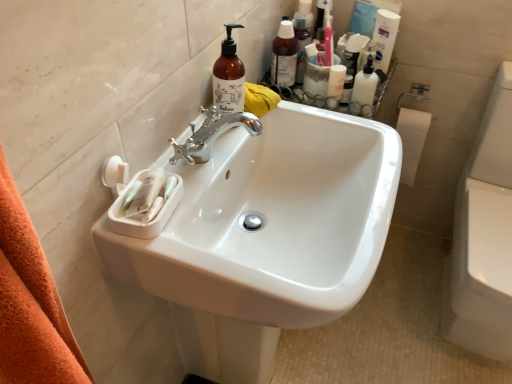
Question: Is white glossy lotion at upper right, acting as the first toiletry starting from the right, facing away from white matte jar at upper right, the second toiletry viewed from the left?

Choices:
 (A) no
 (B) yes

Answer: (A)

Question: Is white glossy lotion at upper right, marked as the 3th toiletry in a left-to-right arrangement, shorter than white matte jar at upper right, the 2th toiletry when ordered from right to left?

Choices:
 (A) yes
 (B) no

Answer: (B)

Question: From a real-world perspective, is white glossy lotion at upper right, marked as the 3th toiletry in a left-to-right arrangement, over white matte jar at upper right, the second toiletry viewed from the left?

Choices:
 (A) yes
 (B) no

Answer: (A)

Question: Does white glossy lotion at upper right, acting as the first toiletry starting from the right, have a smaller size compared to white matte jar at upper right, the second toiletry viewed from the left?

Choices:
 (A) yes
 (B) no

Answer: (B)

Question: Is there a large distance between white glossy lotion at upper right, marked as the 3th toiletry in a left-to-right arrangement, and white matte jar at upper right, the second toiletry viewed from the left?

Choices:
 (A) no
 (B) yes

Answer: (A)

Question: Is white glossy lotion at upper right, acting as the first toiletry starting from the right, wider or thinner than translucent amber bottle at upper center, which appears as the second cleaning product when viewed from the top?

Choices:
 (A) thin
 (B) wide

Answer: (A)

Question: From a real-world perspective, is white glossy lotion at upper right, acting as the first toiletry starting from the right, physically located above or below translucent amber bottle at upper center, which ranks as the 1th cleaning product in bottom-to-top order?

Choices:
 (A) below
 (B) above

Answer: (A)

Question: Considering their positions, is white glossy lotion at upper right, acting as the first toiletry starting from the right, located in front of or behind translucent amber bottle at upper center, which ranks as the 1th cleaning product in bottom-to-top order?

Choices:
 (A) behind
 (B) front

Answer: (A)

Question: Does point (361, 71) appear closer or farther from the camera than point (238, 81)?

Choices:
 (A) farther
 (B) closer

Answer: (A)

Question: From a real-world perspective, is white glossy sink at center above or below translucent plastic bottles at upper right, which is the 1th toiletry in left-to-right order?

Choices:
 (A) below
 (B) above

Answer: (A)

Question: Choose the correct answer: Is white glossy sink at center inside translucent plastic bottles at upper right, which is the 1th toiletry in left-to-right order, or outside it?

Choices:
 (A) inside
 (B) outside

Answer: (B)

Question: In terms of width, does white glossy sink at center look wider or thinner when compared to translucent plastic bottles at upper right, the third toiletry viewed from the right?

Choices:
 (A) thin
 (B) wide

Answer: (B)

Question: Is point (246, 190) positioned closer to the camera than point (294, 61)?

Choices:
 (A) farther
 (B) closer

Answer: (B)

Question: From their relative heights in the image, would you say translucent plastic bottles at upper right, which is the 1th toiletry in left-to-right order, is taller or shorter than white glossy lotion at upper right, marked as the 3th toiletry in a left-to-right arrangement?

Choices:
 (A) tall
 (B) short

Answer: (A)

Question: Relative to white glossy lotion at upper right, marked as the 3th toiletry in a left-to-right arrangement, is translucent plastic bottles at upper right, the third toiletry viewed from the right, in front or behind?

Choices:
 (A) front
 (B) behind

Answer: (B)